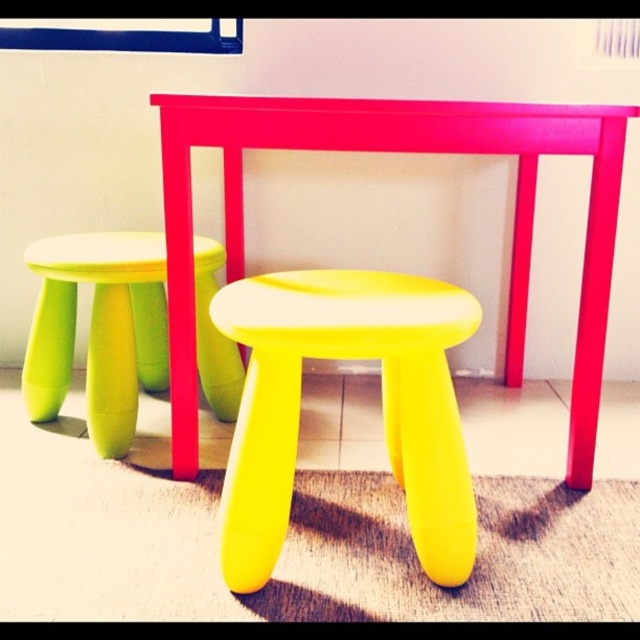
You are standing in front of the bright red table with two colorful stools. There are two points marked in the scene. Which point, point (337, 100) or point (40, 342), is closer to you?

Point (337, 100) is closer to the camera than point (40, 342).

You are a small robot with a diameter of 10 inches. You are positioned near the yellow matte stool at lower left and want to move to the matte pink table at center. Can you navigate the space between them without any obstacles?

The distance between the matte pink table at center and the yellow matte stool at lower left is 11.27 inches. Since the robot has a diameter of 10 inches, it can safely navigate the space between them as the distance is greater than the robot size.

You are arranging a small party and need to place decorations on the yellow matte stool at center and the yellow matte stool at lower left. Which stool is directly above the other?

The yellow matte stool at center is positioned under the yellow matte stool at lower left, so the yellow matte stool at lower left is directly above the yellow matte stool at center.